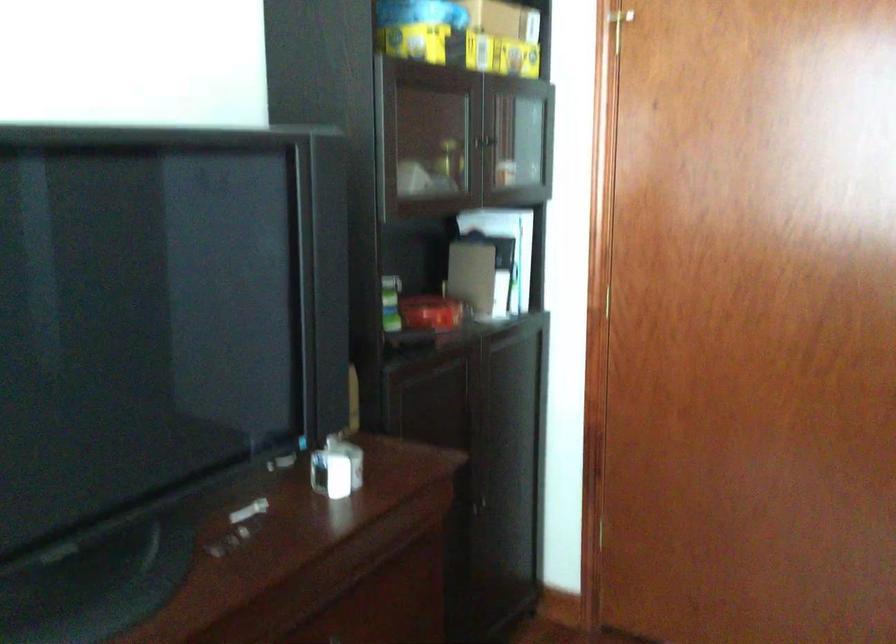
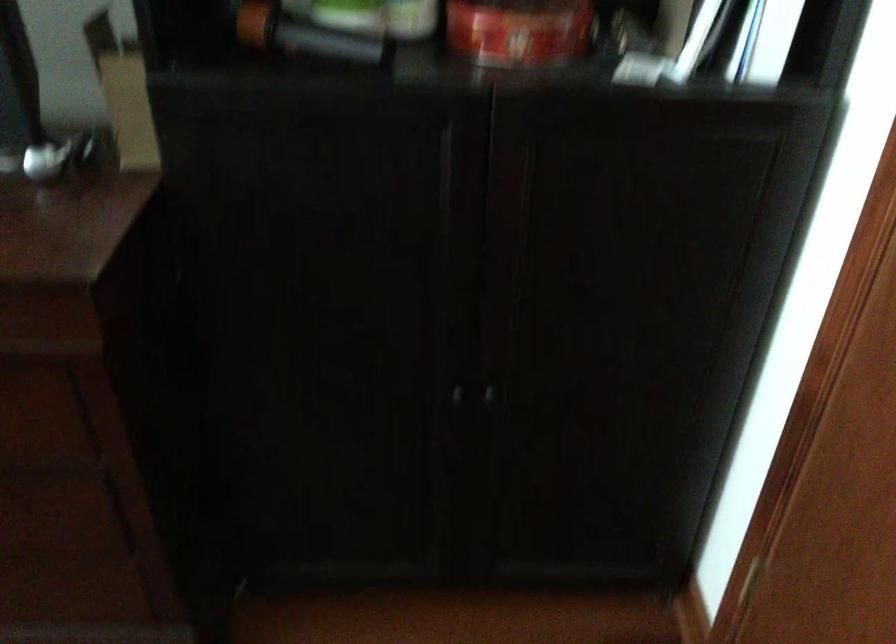
Locate, in the second image, the point that corresponds to point 451,317 in the first image.

(519, 31)